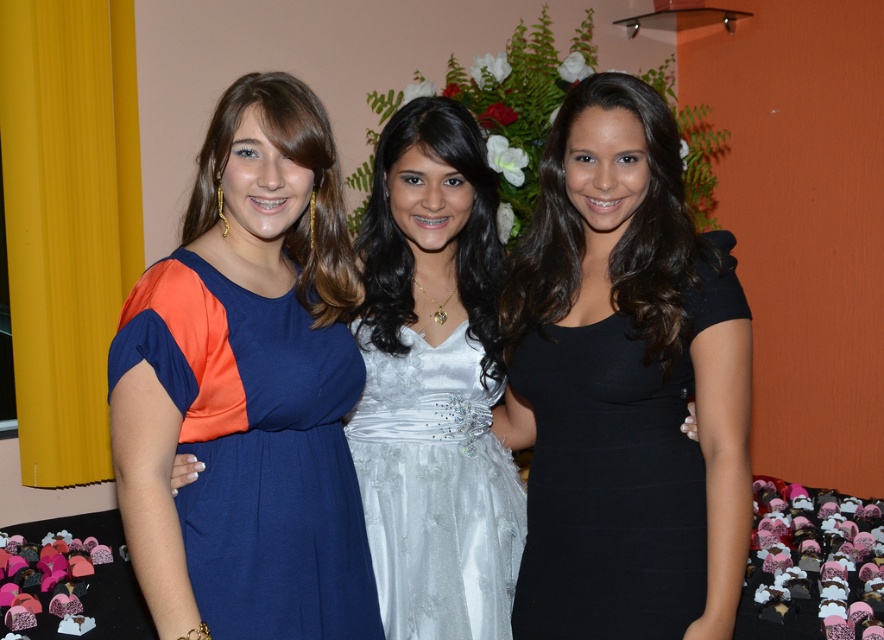
You are a photographer at a formal event and need to position two guests for a photo. You have the black matte dress at center and the satin white dress at center. Which one is on the right side when facing the same direction as the original image?

The black matte dress at center is to the right of the satin white dress at center, so when facing the same direction as the original image, the black matte dress at center is on the right side.